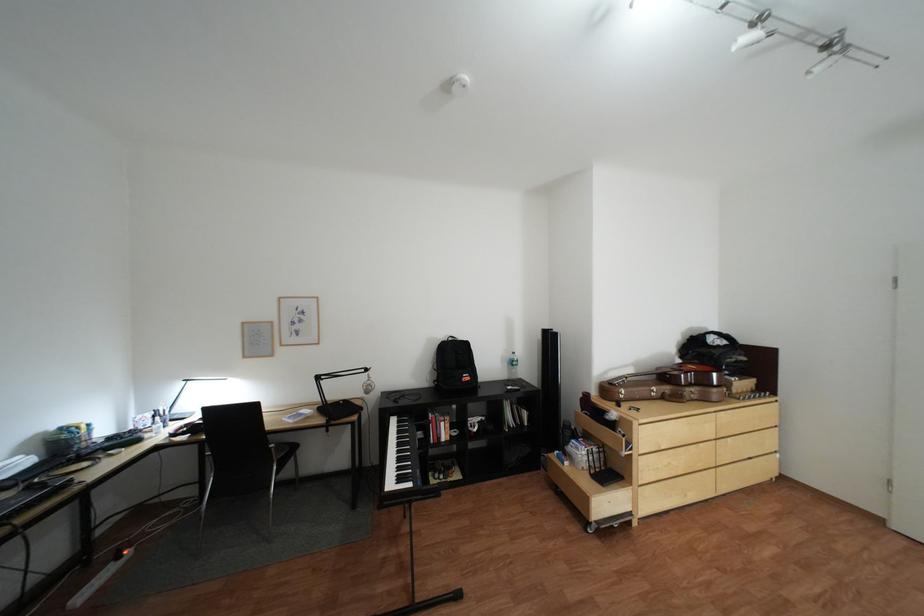
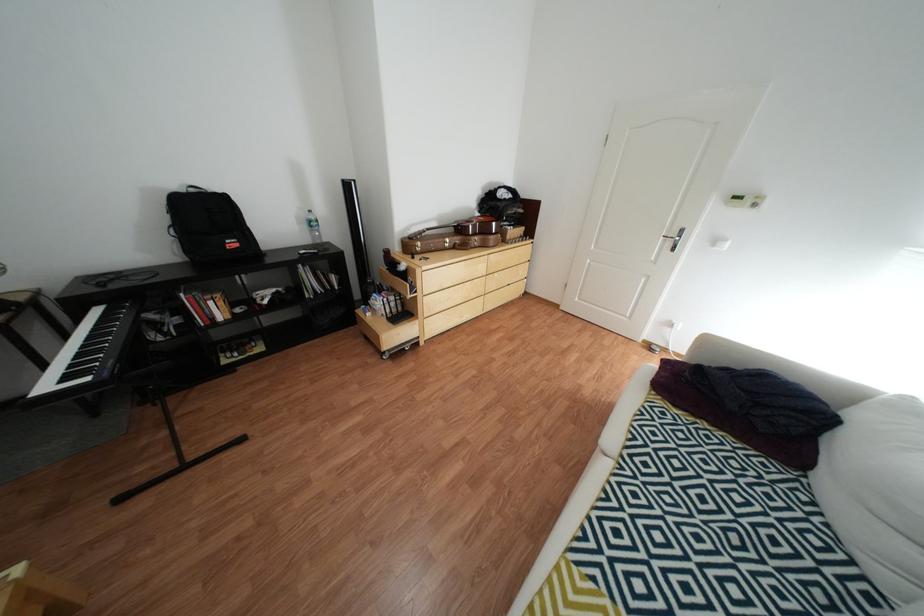
How did the camera likely rotate?

The camera's rotation is toward right-down.